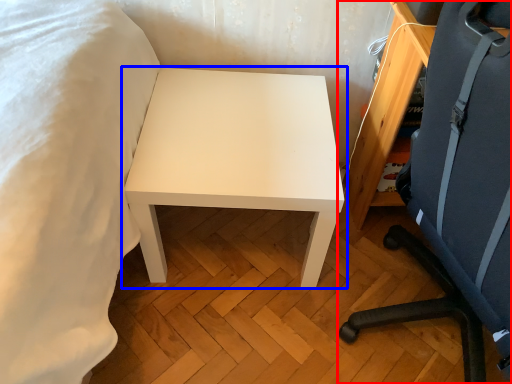
Question: Which of the following is the closest to the observer, chair (highlighted by a red box) or table (highlighted by a blue box)?

Choices:
 (A) chair
 (B) table

Answer: (A)